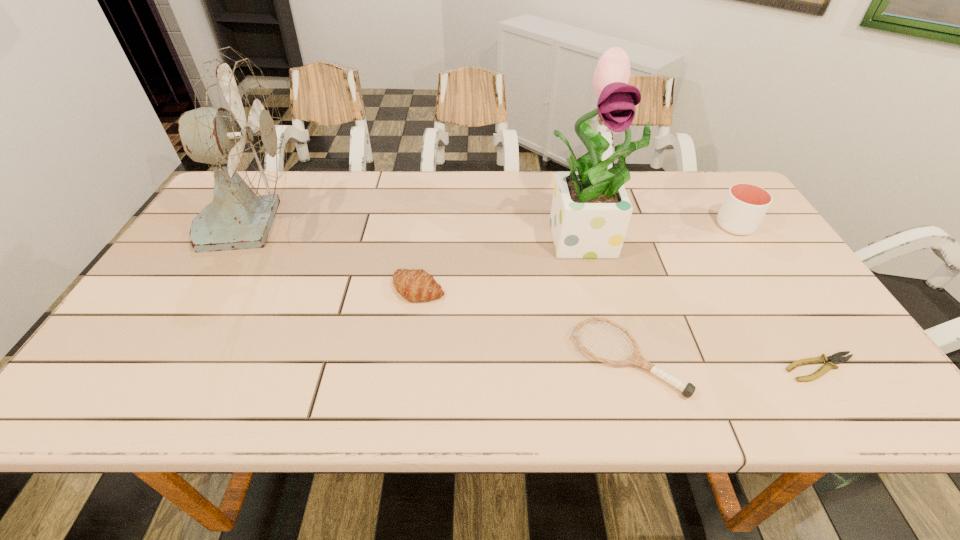
This screenshot has width=960, height=540. What are the coordinates of `vacant space that satisfies the following two spatial constraints: 1. on the front-facing side of the tennis racket; 2. on the right side of the flower arrangement` in the screenshot? It's located at (621, 358).

Identify the location of free location that satisfies the following two spatial constraints: 1. in front of the fan to blow air; 2. on the right side of the crescent roll. (212, 288).

I want to click on free space that satisfies the following two spatial constraints: 1. in front of the fan to blow air; 2. on the back side of the third tallest object, so click(250, 226).

Locate an element on the screen. vacant region that satisfies the following two spatial constraints: 1. in front of the fan to blow air; 2. on the back side of the shortest object is located at coordinates pos(165,368).

The width and height of the screenshot is (960, 540). Identify the location of free space that satisfies the following two spatial constraints: 1. in front of the fan to blow air; 2. on the left side of the second shortest object. (171, 358).

Locate an element on the screen. This screenshot has width=960, height=540. blank space that satisfies the following two spatial constraints: 1. in front of the shortest object to blow air; 2. on the left side of the fan is located at coordinates (165, 368).